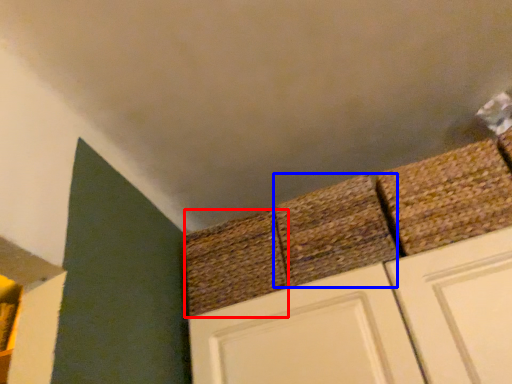
Question: Which object appears farthest to the camera in this image, brick (highlighted by a red box) or brick (highlighted by a blue box)?

Choices:
 (A) brick
 (B) brick

Answer: (A)